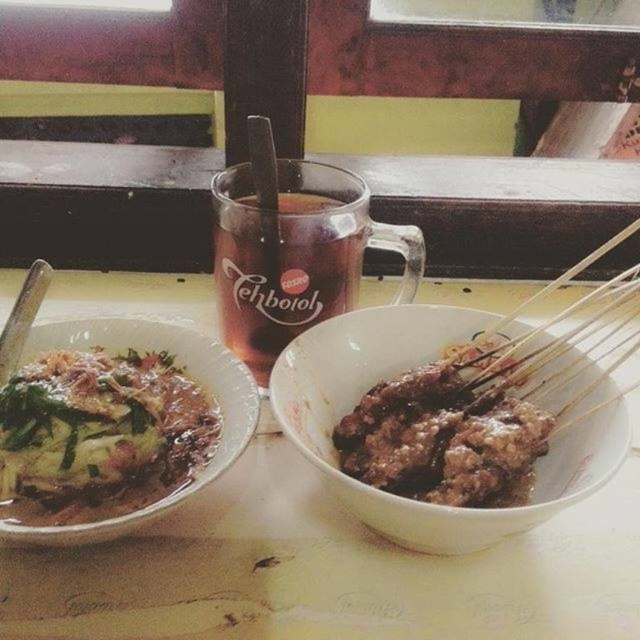
Does translucent glass mug at center have a lesser width compared to silver metallic chopstick at upper left?

No, translucent glass mug at center is not thinner than silver metallic chopstick at upper left.

Is translucent glass mug at center further to camera compared to silver metallic chopstick at upper left?

Yes, translucent glass mug at center is behind silver metallic chopstick at upper left.

Which is in front, point (337, 248) or point (28, 301)?

Positioned in front is point (28, 301).

The width and height of the screenshot is (640, 640). Find the location of `translucent glass mug at center`. translucent glass mug at center is located at coordinates (282, 272).

In the scene shown: Does white glossy bowl at center come in front of translucent glass mug at center?

Yes, it is.

Does white glossy bowl at center appear on the right side of translucent glass mug at center?

Yes, white glossy bowl at center is to the right of translucent glass mug at center.

Does point (602, 416) come in front of point (268, 221)?

Yes.

I want to click on white glossy bowl at center, so click(397, 372).

Which is below, brown glossy skewers at center or translucent glass mug at center?

Positioned lower is brown glossy skewers at center.

Does brown glossy skewers at center appear over translucent glass mug at center?

Incorrect, brown glossy skewers at center is not positioned above translucent glass mug at center.

This screenshot has width=640, height=640. Describe the element at coordinates (444, 436) in the screenshot. I see `brown glossy skewers at center` at that location.

Identify the location of brown glossy skewers at center. (444, 436).